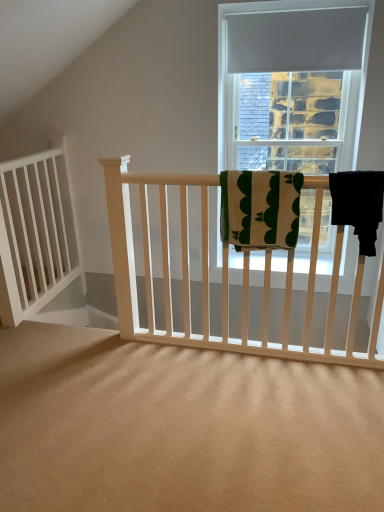
Image resolution: width=384 pixels, height=512 pixels. In order to click on green cotton towel at center, the first beach towel positioned from the left in this screenshot , I will do `click(260, 208)`.

At what (x,y) coordinates should I click in order to perform the action: click on matte gray curtain at upper center. Please return your answer as a coordinate pair (x, y). Looking at the image, I should click on (296, 40).

Describe the element at coordinates (296, 40) in the screenshot. The width and height of the screenshot is (384, 512). I see `matte gray curtain at upper center` at that location.

Identify the location of green cotton towel at center, the 2th beach towel positioned from the right. The width and height of the screenshot is (384, 512). (260, 208).

From the image's perspective, between white wood balustrade at left and matte gray curtain at upper center, who is located below?

white wood balustrade at left, from the image's perspective.

How far apart are white wood balustrade at left and matte gray curtain at upper center?

Result: white wood balustrade at left and matte gray curtain at upper center are 5.76 feet apart from each other.

Does white wood balustrade at left appear on the right side of matte gray curtain at upper center?

No, white wood balustrade at left is not to the right of matte gray curtain at upper center.

Is white wood balustrade at left facing away from matte gray curtain at upper center?

No, white wood balustrade at left is not facing the opposite direction of matte gray curtain at upper center.

From a real-world perspective, relative to matte gray curtain at upper center, is green cotton towel at center, the first beach towel positioned from the left, vertically above or below?

In terms of real-world spatial position, green cotton towel at center, the first beach towel positioned from the left, is below matte gray curtain at upper center.

Can you confirm if green cotton towel at center, the first beach towel positioned from the left, is bigger than matte gray curtain at upper center?

Correct, green cotton towel at center, the first beach towel positioned from the left, is larger in size than matte gray curtain at upper center.

Locate an element on the screen. Image resolution: width=384 pixels, height=512 pixels. beach towel lying on the left of matte gray curtain at upper center is located at coordinates (260, 208).

How many degrees apart are the facing directions of green cotton towel at center, the 2th beach towel positioned from the right, and matte gray curtain at upper center?

0.00175 degrees.

In terms of width, does black fabric towel at right, placed as the 1th beach towel when sorted from right to left, look wider or thinner when compared to green cotton towel at center, the first beach towel positioned from the left?

black fabric towel at right, placed as the 1th beach towel when sorted from right to left, is wider than green cotton towel at center, the first beach towel positioned from the left.

From the image's perspective, is black fabric towel at right, which is the second beach towel in left-to-right order, positioned above or below green cotton towel at center, the first beach towel positioned from the left?

black fabric towel at right, which is the second beach towel in left-to-right order, is below green cotton towel at center, the first beach towel positioned from the left.

Consider the image. Is black fabric towel at right, placed as the 1th beach towel when sorted from right to left, not inside green cotton towel at center, the 2th beach towel positioned from the right?

Indeed, black fabric towel at right, placed as the 1th beach towel when sorted from right to left, is completely outside green cotton towel at center, the 2th beach towel positioned from the right.

The height and width of the screenshot is (512, 384). I want to click on beach towel above the black fabric towel at right, placed as the 1th beach towel when sorted from right to left (from the image's perspective), so click(260, 208).

Is there a large distance between green cotton towel at center, the 2th beach towel positioned from the right, and white wood balustrade at left?

Yes.

Is green cotton towel at center, the first beach towel positioned from the left, at the right side of white wood balustrade at left?

Indeed, green cotton towel at center, the first beach towel positioned from the left, is positioned on the right side of white wood balustrade at left.

The width and height of the screenshot is (384, 512). I want to click on balustrade behind the green cotton towel at center, the first beach towel positioned from the left, so click(x=36, y=233).

Who is shorter, green cotton towel at center, the first beach towel positioned from the left, or white wood balustrade at left?

With less height is green cotton towel at center, the first beach towel positioned from the left.

Can you confirm if white wood balustrade at left is smaller than black fabric towel at right, which is the second beach towel in left-to-right order?

No, white wood balustrade at left is not smaller than black fabric towel at right, which is the second beach towel in left-to-right order.

From their relative heights in the image, would you say white wood balustrade at left is taller or shorter than black fabric towel at right, placed as the 1th beach towel when sorted from right to left?

Considering their sizes, white wood balustrade at left has more height than black fabric towel at right, placed as the 1th beach towel when sorted from right to left.

In the image, is white wood balustrade at left positioned in front of or behind black fabric towel at right, which is the second beach towel in left-to-right order?

white wood balustrade at left is behind black fabric towel at right, which is the second beach towel in left-to-right order.

Based on the photo, from a real-world perspective, is white wood balustrade at left under black fabric towel at right, which is the second beach towel in left-to-right order?

Yes, from a real-world perspective, white wood balustrade at left is beneath black fabric towel at right, which is the second beach towel in left-to-right order.

Which object is wider, black fabric towel at right, which is the second beach towel in left-to-right order, or white wood balustrade at left?

black fabric towel at right, which is the second beach towel in left-to-right order, is wider.

Considering the relative sizes of black fabric towel at right, placed as the 1th beach towel when sorted from right to left, and white wood balustrade at left in the image provided, is black fabric towel at right, placed as the 1th beach towel when sorted from right to left, shorter than white wood balustrade at left?

Yes.

Where is `beach towel below the white wood balustrade at left (from the image's perspective)`? This screenshot has width=384, height=512. beach towel below the white wood balustrade at left (from the image's perspective) is located at coordinates (358, 204).

From the image's perspective, is matte gray curtain at upper center positioned above or below black fabric towel at right, which is the second beach towel in left-to-right order?

Clearly, from the image's perspective, matte gray curtain at upper center is above black fabric towel at right, which is the second beach towel in left-to-right order.

From a real-world perspective, who is located lower, matte gray curtain at upper center or black fabric towel at right, placed as the 1th beach towel when sorted from right to left?

In real-world perspective, black fabric towel at right, placed as the 1th beach towel when sorted from right to left, is lower.

Considering the points (281, 38) and (362, 172), which point is in front, point (281, 38) or point (362, 172)?

Point (362, 172)

Would you say matte gray curtain at upper center contains black fabric towel at right, placed as the 1th beach towel when sorted from right to left?

Actually, black fabric towel at right, placed as the 1th beach towel when sorted from right to left, is outside matte gray curtain at upper center.

This screenshot has height=512, width=384. I want to click on balustrade on the left side of matte gray curtain at upper center, so click(x=36, y=233).

At what (x,y) coordinates should I click in order to perform the action: click on curtain above the green cotton towel at center, the first beach towel positioned from the left (from the image's perspective). Please return your answer as a coordinate pair (x, y). This screenshot has height=512, width=384. Looking at the image, I should click on (296, 40).

When comparing their distances from green cotton towel at center, the 2th beach towel positioned from the right, does black fabric towel at right, placed as the 1th beach towel when sorted from right to left, or matte gray curtain at upper center seem closer?

black fabric towel at right, placed as the 1th beach towel when sorted from right to left, lies closer to green cotton towel at center, the 2th beach towel positioned from the right, than the other object.

Based on their spatial positions, is white wood balustrade at left or black fabric towel at right, which is the second beach towel in left-to-right order, closer to green cotton towel at center, the first beach towel positioned from the left?

black fabric towel at right, which is the second beach towel in left-to-right order.

When comparing their distances from white wood balustrade at left, does green cotton towel at center, the 2th beach towel positioned from the right, or matte gray curtain at upper center seem closer?

Among the two, green cotton towel at center, the 2th beach towel positioned from the right, is located nearer to white wood balustrade at left.

Consider the image. Which object lies further to the anchor point matte gray curtain at upper center, white wood balustrade at left or black fabric towel at right, placed as the 1th beach towel when sorted from right to left?

white wood balustrade at left lies further to matte gray curtain at upper center than the other object.

Based on their spatial positions, is green cotton towel at center, the 2th beach towel positioned from the right, or matte gray curtain at upper center further from black fabric towel at right, which is the second beach towel in left-to-right order?

matte gray curtain at upper center.

Based on their spatial positions, is white wood balustrade at left or green cotton towel at center, the 2th beach towel positioned from the right, further from black fabric towel at right, placed as the 1th beach towel when sorted from right to left?

white wood balustrade at left is further to black fabric towel at right, placed as the 1th beach towel when sorted from right to left.

Based on their spatial positions, is white wood balustrade at left or matte gray curtain at upper center further from black fabric towel at right, which is the second beach towel in left-to-right order?

Among the two, white wood balustrade at left is located further to black fabric towel at right, which is the second beach towel in left-to-right order.

From the image, which object appears to be farther from green cotton towel at center, the first beach towel positioned from the left, white wood balustrade at left or matte gray curtain at upper center?

Based on the image, white wood balustrade at left appears to be further to green cotton towel at center, the first beach towel positioned from the left.

Find the location of a particular element. beach towel between white wood balustrade at left and black fabric towel at right, which is the second beach towel in left-to-right order, in the horizontal direction is located at coordinates (260, 208).

Find the location of a particular element. beach towel between white wood balustrade at left and matte gray curtain at upper center in the horizontal direction is located at coordinates 260,208.

What are the coordinates of `beach towel between matte gray curtain at upper center and black fabric towel at right, placed as the 1th beach towel when sorted from right to left, vertically` in the screenshot? It's located at (260, 208).

Identify the location of curtain situated between white wood balustrade at left and black fabric towel at right, placed as the 1th beach towel when sorted from right to left, from left to right. The width and height of the screenshot is (384, 512). (296, 40).